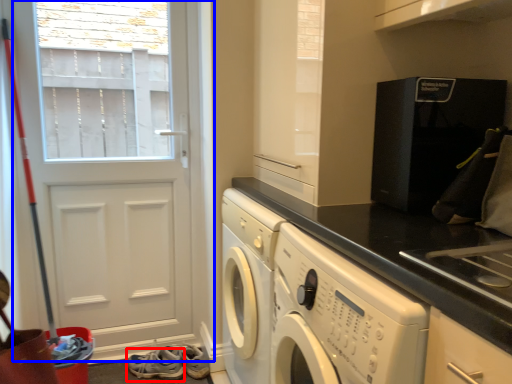
Question: Among these objects, which one is nearest to the camera, shoe (highlighted by a red box) or door (highlighted by a blue box)?

Choices:
 (A) shoe
 (B) door

Answer: (B)